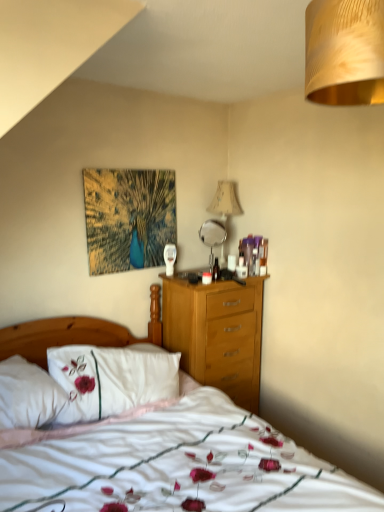
Question: Is gold textured lampshade at upper right, the second lamp when ordered from back to front, positioned behind white soft bed at center?

Choices:
 (A) yes
 (B) no

Answer: (A)

Question: Is gold textured lampshade at upper right, the second lamp when ordered from back to front, turned away from white soft bed at center?

Choices:
 (A) no
 (B) yes

Answer: (A)

Question: From a real-world perspective, is gold textured lampshade at upper right, the second lamp when ordered from back to front, under white soft bed at center?

Choices:
 (A) no
 (B) yes

Answer: (A)

Question: Is gold textured lampshade at upper right, marked as the first lamp in a front-to-back arrangement, not near white soft bed at center?

Choices:
 (A) yes
 (B) no

Answer: (A)

Question: Can you confirm if gold textured lampshade at upper right, marked as the first lamp in a front-to-back arrangement, is smaller than white soft bed at center?

Choices:
 (A) no
 (B) yes

Answer: (B)

Question: Is metallic silver mirror at center taller or shorter than white soft bed at center?

Choices:
 (A) tall
 (B) short

Answer: (B)

Question: Considering their positions, is metallic silver mirror at center located in front of or behind white soft bed at center?

Choices:
 (A) front
 (B) behind

Answer: (B)

Question: Considering the positions of metallic silver mirror at center and white soft bed at center in the image, is metallic silver mirror at center bigger or smaller than white soft bed at center?

Choices:
 (A) small
 (B) big

Answer: (A)

Question: Is metallic silver mirror at center wider or thinner than white soft bed at center?

Choices:
 (A) thin
 (B) wide

Answer: (A)

Question: Is white soft bed at center taller or shorter than white embroidered pillow at left?

Choices:
 (A) short
 (B) tall

Answer: (B)

Question: Considering the relative positions of white soft bed at center and white embroidered pillow at left in the image provided, is white soft bed at center to the left or to the right of white embroidered pillow at left?

Choices:
 (A) left
 (B) right

Answer: (B)

Question: Is white soft bed at center inside the boundaries of white embroidered pillow at left, or outside?

Choices:
 (A) inside
 (B) outside

Answer: (B)

Question: Considering the positions of white soft bed at center and white embroidered pillow at left in the image, is white soft bed at center bigger or smaller than white embroidered pillow at left?

Choices:
 (A) big
 (B) small

Answer: (A)

Question: From a real-world perspective, is gold textured lampshade at upper right, the second lamp when ordered from back to front, above or below beige fabric lampshade at upper center, which is the second lamp from front to back?

Choices:
 (A) below
 (B) above

Answer: (B)

Question: Is gold textured lampshade at upper right, the second lamp when ordered from back to front, to the left or to the right of beige fabric lampshade at upper center, the first lamp from the back, in the image?

Choices:
 (A) right
 (B) left

Answer: (A)